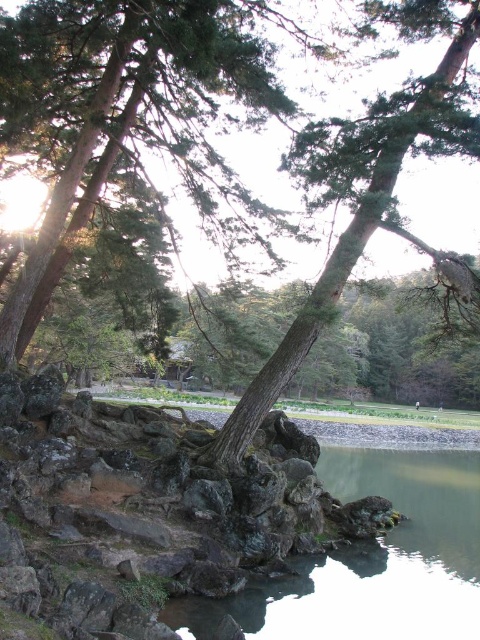
You are standing in the natural scene and want to walk from the point closer to you to the point further away. Which path should you take between the two points, point (470, 548) and point (314, 324)?

You should walk from point (470, 548) to point (314, 324) because point (470, 548) is closer to you and point (314, 324) is further away, so moving from the closer to the further point follows the desired path.

You are a hiker standing at the edge of the water. You see the smooth gray water at lower center and the smooth brown tree trunk at center. Which object is closer to your current position?

The smooth gray water at lower center is closer to your current position because it is located below the smooth brown tree trunk at center, meaning it is nearer to the hiker standing at the edge of the water.

You are a hiker trying to cross a stream. You see the smooth gray water at lower center and the smooth brown tree trunk at center. Which one is bigger in size?

The smooth gray water at lower center is larger in size than the smooth brown tree trunk at center.